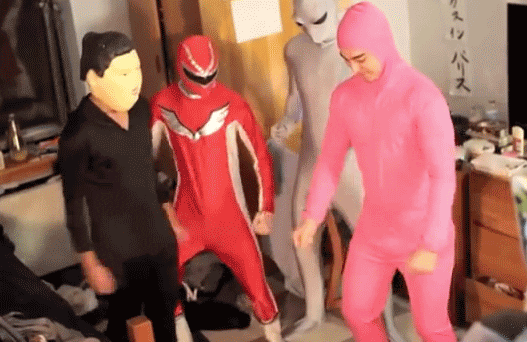
The width and height of the screenshot is (527, 342). In order to click on beige floor in this screenshot , I will do `click(331, 325)`.